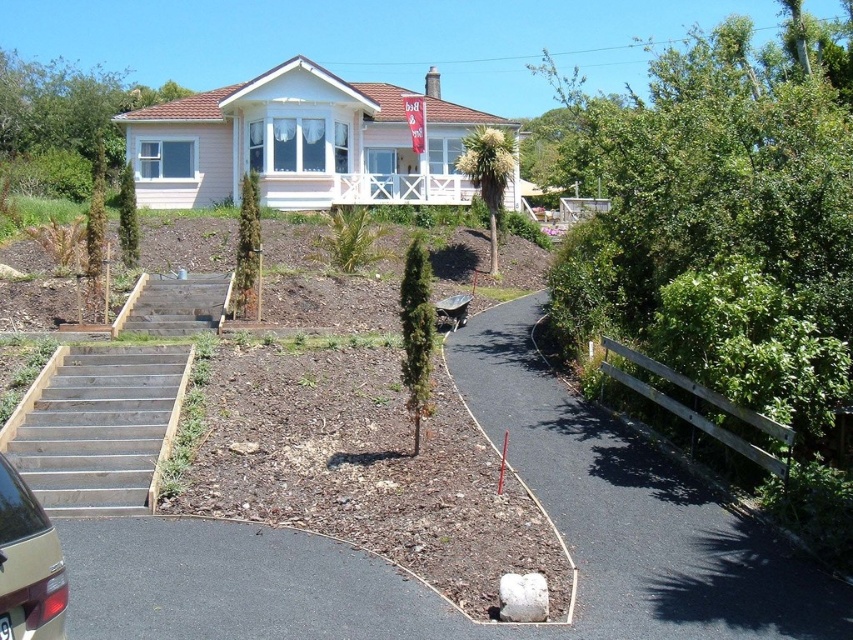
You are a delivery person with a cart that is 2 meters wide. You need to move from the wooden stairs at lower left to the metallic gold car at lower left. Can your cart fit through the space between them?

The distance between the wooden stairs at lower left and the metallic gold car at lower left is 5.97 meters, so the cart that is 2 meters wide can fit through the space between them.

You are standing in front of the house and want to know which of the two points, point [447,616] or point [135,291], is closer to you. Can you determine this based on the scene?

Point [447,616] is closer to the camera than point [135,291], so it is closer to you.